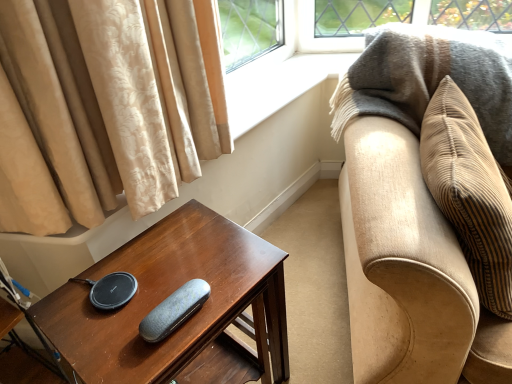
Where is `blank space situated above dark brown wood table at lower left (from a real-world perspective)`? blank space situated above dark brown wood table at lower left (from a real-world perspective) is located at coordinates (164, 272).